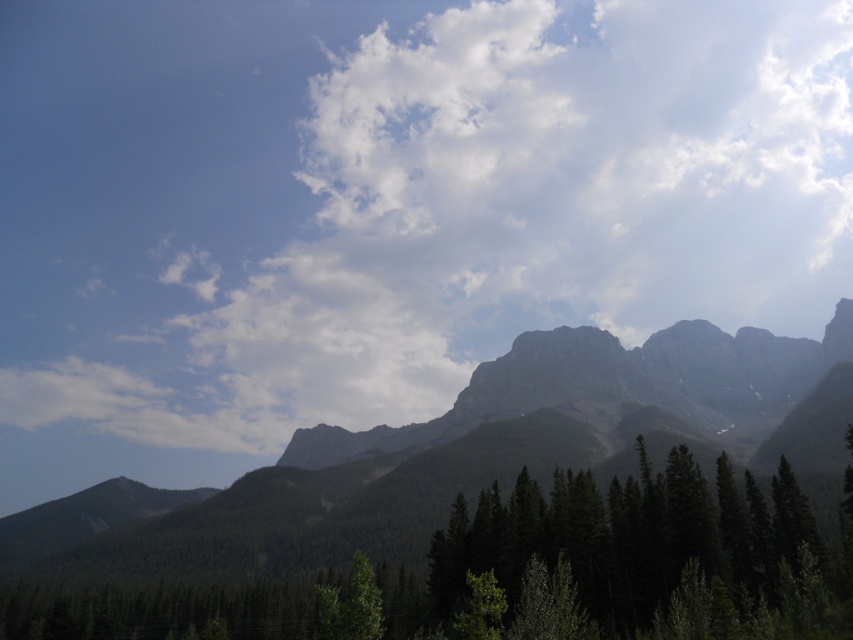
Question: From the image, what is the correct spatial relationship of rocky gray mountain range at center in relation to green matte tree at lower center?

Choices:
 (A) below
 (B) above

Answer: (A)

Question: Estimate the real-world distances between objects in this image. Which object is farther from the green matte tree at lower center?

Choices:
 (A) rocky gray mountain range at center
 (B) white fluffy cloud at upper center
 (C) green matte tree at center

Answer: (B)

Question: Estimate the real-world distances between objects in this image. Which object is closer to the rocky gray mountain range at center?

Choices:
 (A) green matte tree at lower center
 (B) green matte tree at center

Answer: (A)

Question: Is white fluffy cloud at upper center in front of green matte tree at lower center?

Choices:
 (A) no
 (B) yes

Answer: (A)

Question: Does rocky gray mountain range at center appear over green matte tree at center?

Choices:
 (A) yes
 (B) no

Answer: (B)

Question: Which object appears farthest from the camera in this image?

Choices:
 (A) green matte tree at lower center
 (B) rocky gray mountain range at center

Answer: (B)